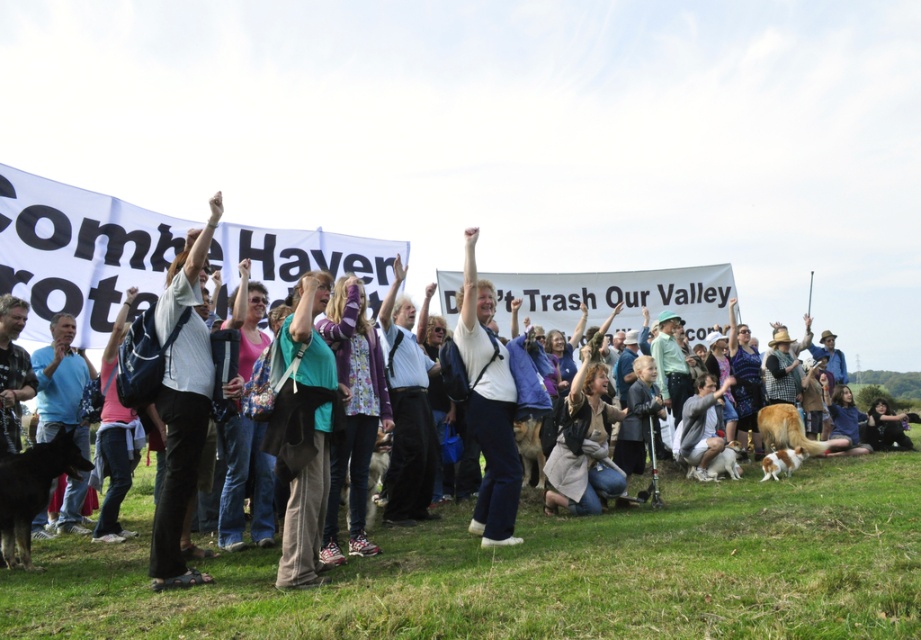
Question: Is white cotton shirt at center below light gray cotton shirt at center?

Choices:
 (A) yes
 (B) no

Answer: (A)

Question: Can you confirm if white matte jacket at center is smaller than blue cotton shirt at left?

Choices:
 (A) yes
 (B) no

Answer: (B)

Question: Is light gray cotton shirt at center smaller than blue cotton shirt at left?

Choices:
 (A) no
 (B) yes

Answer: (A)

Question: Based on their relative distances, which object is farther from the white cotton shirt at center?

Choices:
 (A) light gray cotton shirt at center
 (B) white matte jacket at center
 (C) blue cotton shirt at left

Answer: (C)

Question: Which of the following is the closest to the observer?

Choices:
 (A) white matte jacket at center
 (B) light gray cotton shirt at center
 (C) blue cotton shirt at left
 (D) white cotton shirt at center

Answer: (B)

Question: Which point appears farthest from the camera in this image?

Choices:
 (A) (476, 387)
 (B) (152, 534)

Answer: (A)